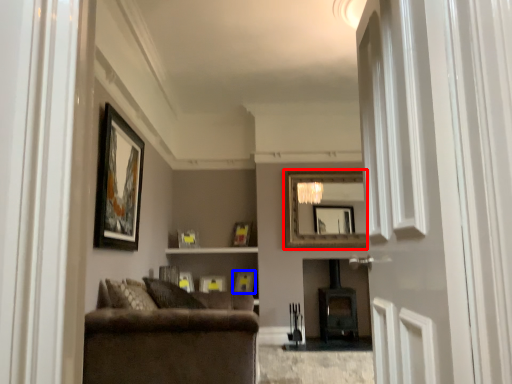
Question: Which point is closer to the camera, mirror (highlighted by a red box) or picture frame (highlighted by a blue box)?

Choices:
 (A) mirror
 (B) picture frame

Answer: (B)